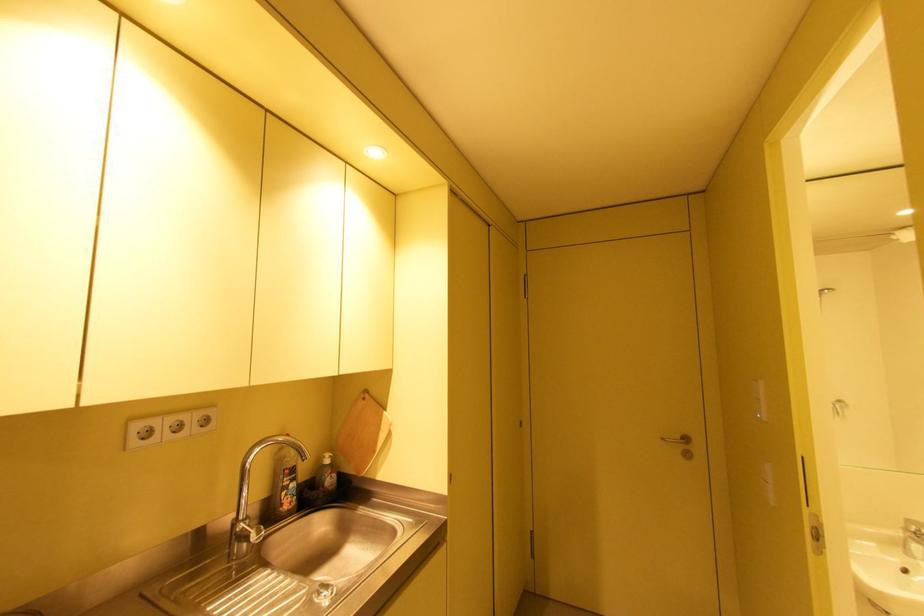
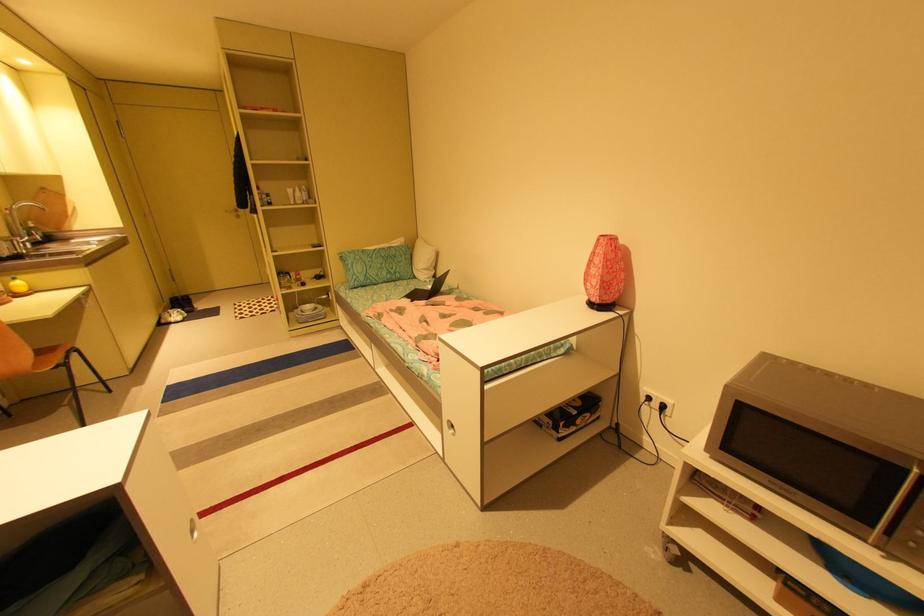
Where in the second image is the point corresponding to point 669,439 from the first image?

(232, 211)